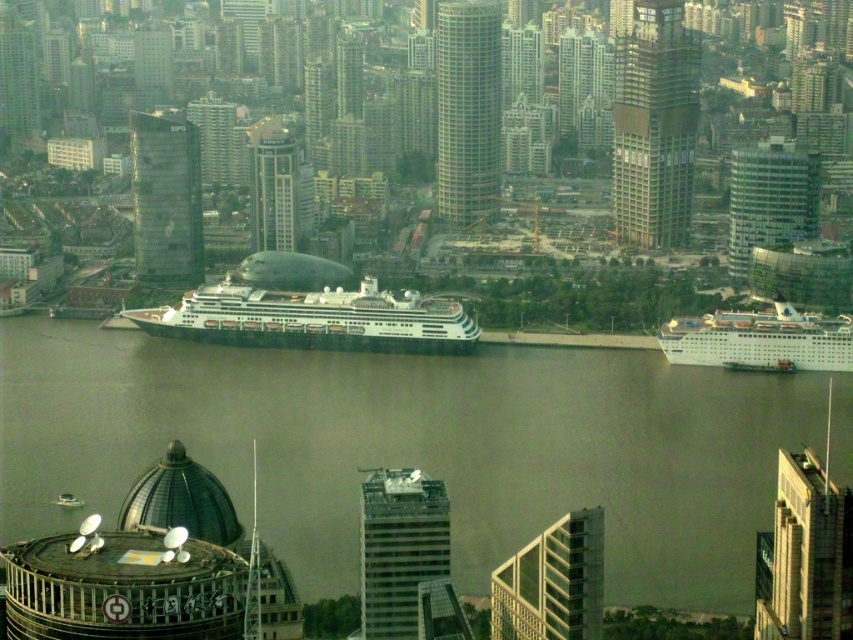
Does metallic glass skyscraper at center have a greater height compared to glassy reflective skyscraper at center?

Correct, metallic glass skyscraper at center is much taller as glassy reflective skyscraper at center.

Does metallic glass skyscraper at center appear on the left side of glassy reflective skyscraper at center?

In fact, metallic glass skyscraper at center is to the right of glassy reflective skyscraper at center.

Is point (556, 524) more distant than point (198, 131)?

No, it is in front of (198, 131).

The width and height of the screenshot is (853, 640). I want to click on metallic glass skyscraper at center, so [x=552, y=582].

Is brown water at center wider than white glossy boat at lower left?

Indeed, brown water at center has a greater width compared to white glossy boat at lower left.

Does brown water at center have a lesser width compared to white glossy boat at lower left?

No, brown water at center is not thinner than white glossy boat at lower left.

Locate an element on the screen. brown water at center is located at coordinates (415, 448).

You are a GUI agent. You are given a task and a screenshot of the screen. Output one action in this format:
    pyautogui.click(x=<x>, y=<y>)
    Task: Click on the brown water at center
    The image size is (853, 640).
    Given the screenshot: What is the action you would take?
    pyautogui.click(x=415, y=448)

Does white glossy cruise ship at right come in front of matte glass skyscraper at center?

That is False.

Is white glossy cruise ship at right behind matte glass skyscraper at center?

Yes, it is behind matte glass skyscraper at center.

Is point (762, 340) closer to viewer compared to point (274, 221)?

No, it is not.

Where is `white glossy cruise ship at right`? The height and width of the screenshot is (640, 853). white glossy cruise ship at right is located at coordinates (759, 340).